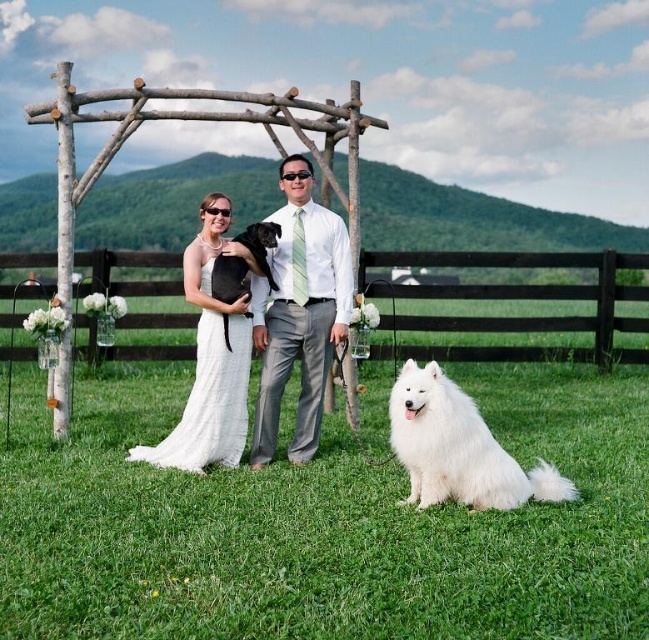
Can you confirm if black wooden fence at lower center is positioned above white fluffy dog at lower right?

Indeed, black wooden fence at lower center is positioned over white fluffy dog at lower right.

Can you confirm if black wooden fence at lower center is positioned to the left of white fluffy dog at lower right?

Yes, black wooden fence at lower center is to the left of white fluffy dog at lower right.

The width and height of the screenshot is (649, 640). Find the location of `black wooden fence at lower center`. black wooden fence at lower center is located at coordinates (519, 298).

Which is below, black wooden fence at lower center or white satin dress at center?

white satin dress at center

Is black wooden fence at lower center thinner than white satin dress at center?

Yes.

Is point (471, 348) positioned behind point (236, 324)?

Yes, point (471, 348) is behind point (236, 324).

The height and width of the screenshot is (640, 649). Find the location of `black wooden fence at lower center`. black wooden fence at lower center is located at coordinates (519, 298).

Is white satin dress at center behind black fur dog at center?

No, white satin dress at center is in front of black fur dog at center.

Can you confirm if white satin dress at center is shorter than black fur dog at center?

No, white satin dress at center is not shorter than black fur dog at center.

Who is more distant from viewer, [227,412] or [232,294]?

The point [227,412] is behind.

Find the location of a particular element. Image resolution: width=649 pixels, height=640 pixels. white satin dress at center is located at coordinates (212, 356).